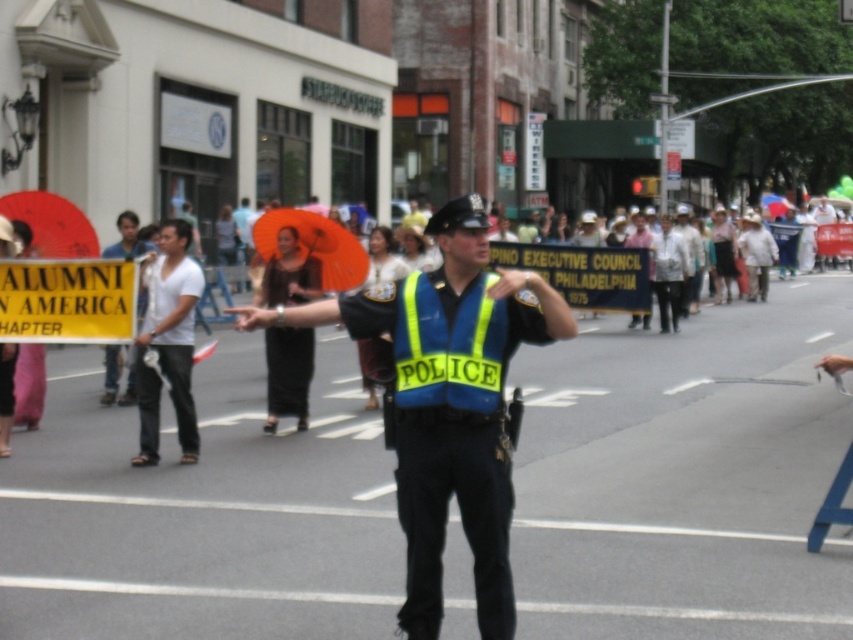
You are a pedestrian trying to cross the street and see the yellow reflective fabric police vest at center and the white cotton shirt at left. Which object is taller from your viewpoint?

The yellow reflective fabric police vest at center is much taller than the white cotton shirt at left.

You are a pedestrian trying to follow the police officer who is pointing towards the left side of the frame. The officer is wearing a blue reflective vest at center and a white cotton shirt at left. Which clothing item should you focus on to determine the direction the officer is facing?

The blue reflective vest at center is located above the white cotton shirt at left, so the officer is facing towards the left side as the vest is positioned higher up relative to the shirt, indicating the direction they are pointing.